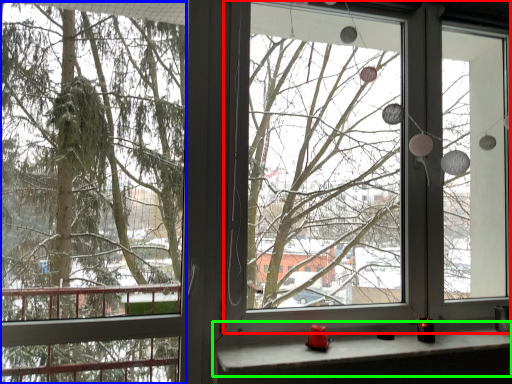
Question: Which object is the farthest from window screen (highlighted by a red box)? Choose among these: tree (highlighted by a blue box) or window sill (highlighted by a green box).

Choices:
 (A) tree
 (B) window sill

Answer: (B)